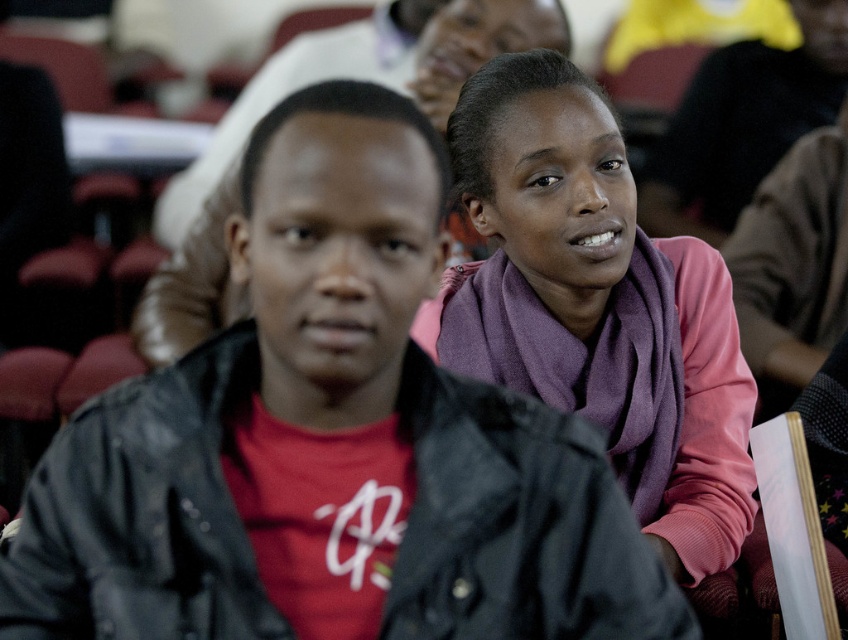
Question: Can you confirm if purple scarf at upper right is smaller than purple scarf at center?

Choices:
 (A) yes
 (B) no

Answer: (A)

Question: Does purple scarf at upper right have a smaller size compared to purple scarf at center?

Choices:
 (A) no
 (B) yes

Answer: (B)

Question: Is purple scarf at upper right in front of purple scarf at center?

Choices:
 (A) yes
 (B) no

Answer: (A)

Question: Which point appears closest to the camera in this image?

Choices:
 (A) (640, 294)
 (B) (56, 609)

Answer: (B)

Question: Among these objects, which one is farthest from the camera?

Choices:
 (A) purple scarf at upper right
 (B) purple scarf at center

Answer: (B)